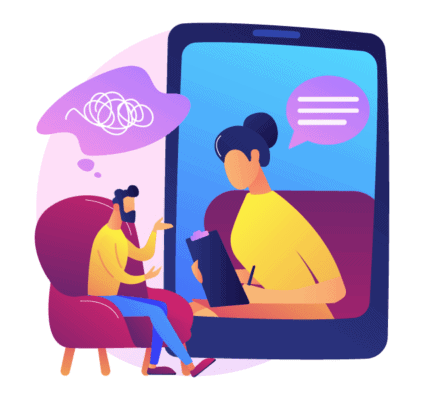
Locate an element on the screen. This screenshot has height=400, width=428. large tablet is located at coordinates (317, 151).